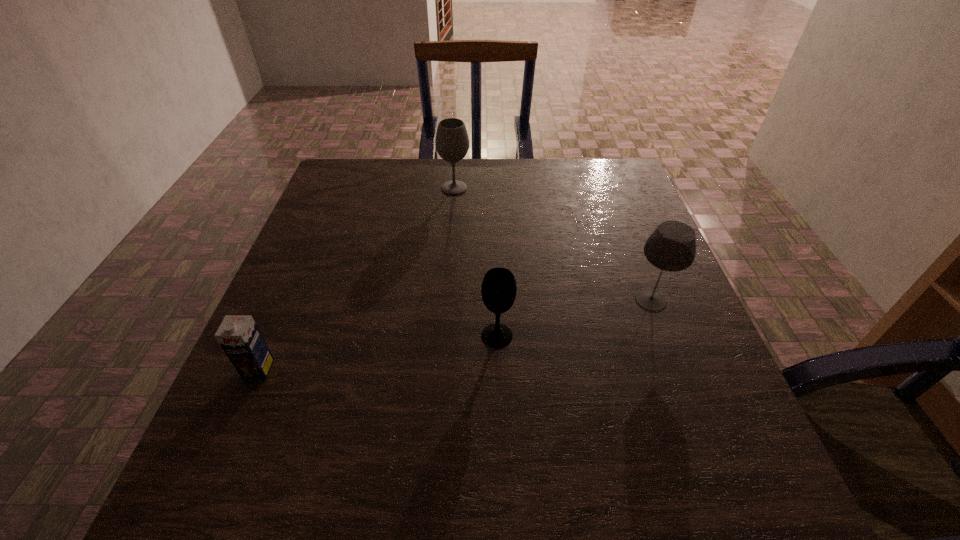
Image resolution: width=960 pixels, height=540 pixels. What are the coordinates of `vacant space located 0.180m on the front of the third farthest object` in the screenshot? It's located at (500, 436).

Find the location of a particular element. The image size is (960, 540). free location located on the front label of the chocolate milk is located at coordinates click(229, 436).

Find the location of `object that is at the far edge`. object that is at the far edge is located at coordinates (452, 142).

Find the location of `object that is at the left edge`. object that is at the left edge is located at coordinates (238, 335).

Image resolution: width=960 pixels, height=540 pixels. What are the coordinates of `object that is at the right edge` in the screenshot? It's located at (671, 247).

Locate an element on the screen. free space at the far edge is located at coordinates (508, 167).

This screenshot has height=540, width=960. In order to click on vacant region at the near edge of the desktop in this screenshot , I will do `click(630, 517)`.

Where is `free space at the left edge of the desktop`? This screenshot has height=540, width=960. free space at the left edge of the desktop is located at coordinates (363, 251).

This screenshot has height=540, width=960. Find the location of `free spot at the right edge of the desktop`. free spot at the right edge of the desktop is located at coordinates (744, 432).

Locate an element on the screen. free point at the far right corner is located at coordinates (591, 202).